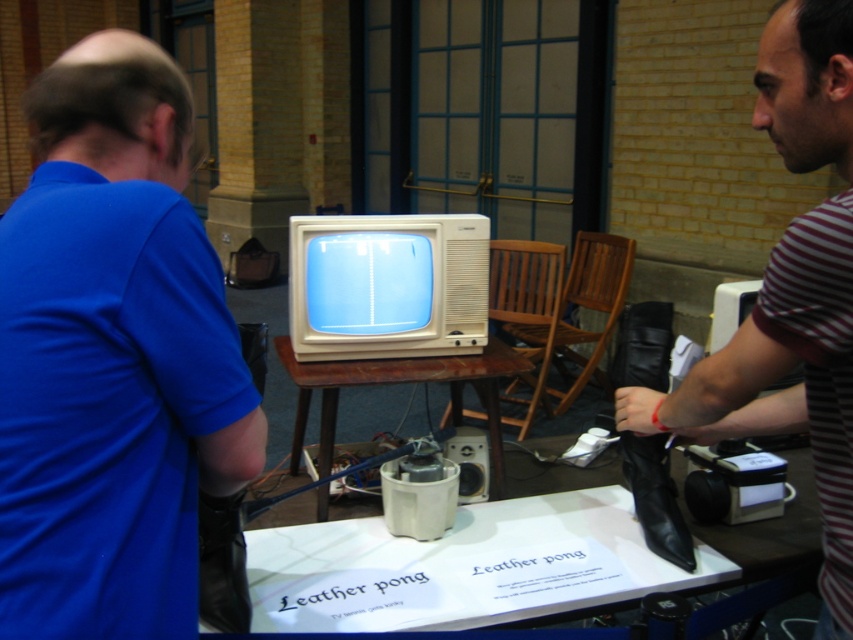
Question: Which point appears closest to the camera in this image?

Choices:
 (A) (428, 358)
 (B) (3, 497)
 (C) (834, 371)

Answer: (B)

Question: Is white paper at center to the left of wooden table at center from the viewer's perspective?

Choices:
 (A) no
 (B) yes

Answer: (A)

Question: Which object appears farthest from the camera in this image?

Choices:
 (A) striped cotton shirt at right
 (B) blue matte shirt at left
 (C) wooden table at center

Answer: (C)

Question: Is blue matte shirt at left positioned before striped cotton shirt at right?

Choices:
 (A) yes
 (B) no

Answer: (A)

Question: Which object is positioned closest to the striped cotton shirt at right?

Choices:
 (A) white paper at center
 (B) blue matte shirt at left
 (C) wooden table at center

Answer: (A)

Question: Is white paper at center wider than wooden table at center?

Choices:
 (A) yes
 (B) no

Answer: (A)